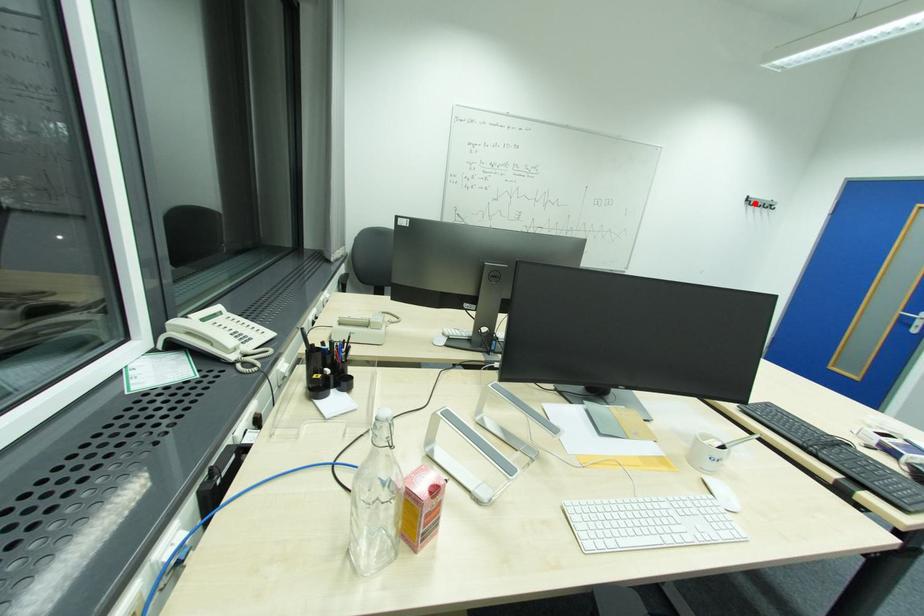
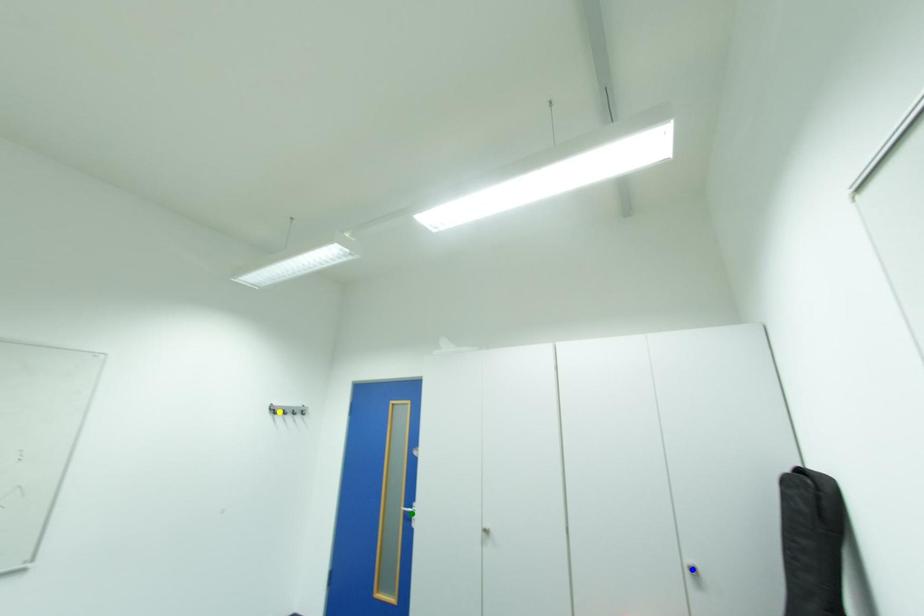
Question: I am providing you with two images of the same scene from different viewpoints. A red point is marked on the first image. You are given multiple points on the second image. Which point in image 2 is actually the same real-world point as the red point in image 1?

Choices:
 (A) green point
 (B) blue point
 (C) yellow point

Answer: (C)